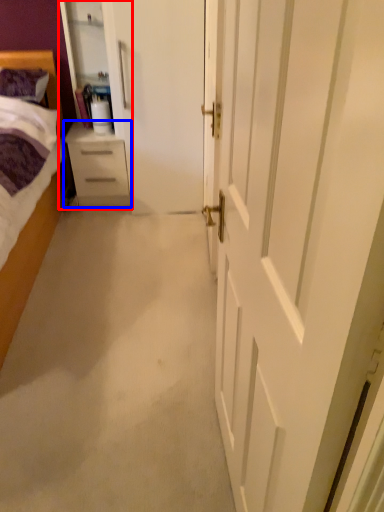
Question: Which point is closer to the camera, armoire (highlighted by a red box) or chest of drawers (highlighted by a blue box)?

Choices:
 (A) armoire
 (B) chest of drawers

Answer: (A)